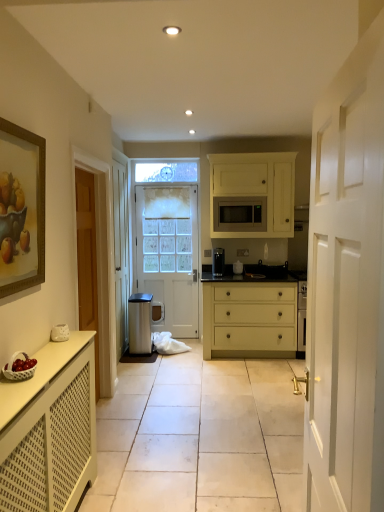
At what (x,y) coordinates should I click in order to perform the action: click on empty space that is ontop of white matte cabinet at lower left, positioned as the 1th cabinetry in bottom-to-top order. Please return your answer as a coordinate pair (x, y). The width and height of the screenshot is (384, 512). Looking at the image, I should click on (31, 364).